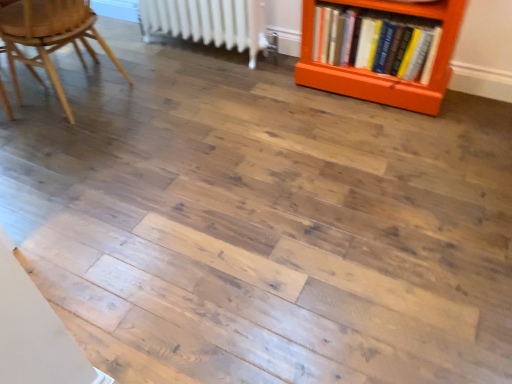
You are a GUI agent. You are given a task and a screenshot of the screen. Output one action in this format:
    pyautogui.click(x=<x>, y=<y>)
    Task: Click on the vacant area to the right of wooden chair at left
    The height and width of the screenshot is (384, 512).
    Given the screenshot: What is the action you would take?
    pyautogui.click(x=187, y=105)